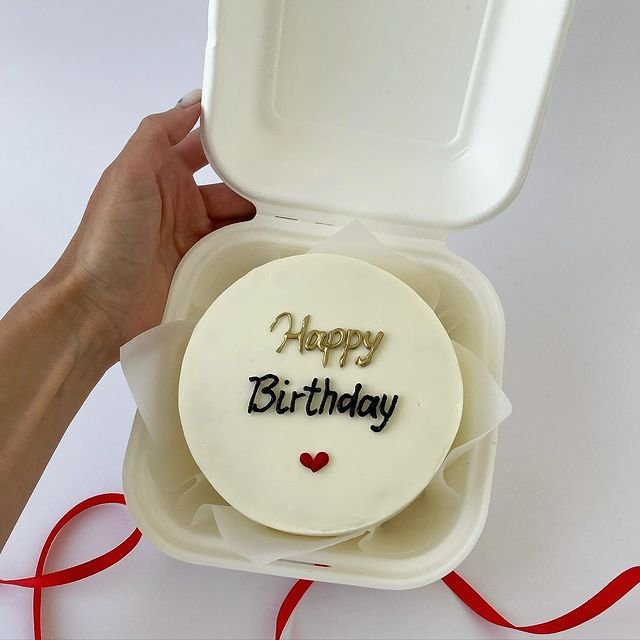
Find the location of a particular element. This screenshot has height=640, width=640. casing is located at coordinates tap(386, 192).